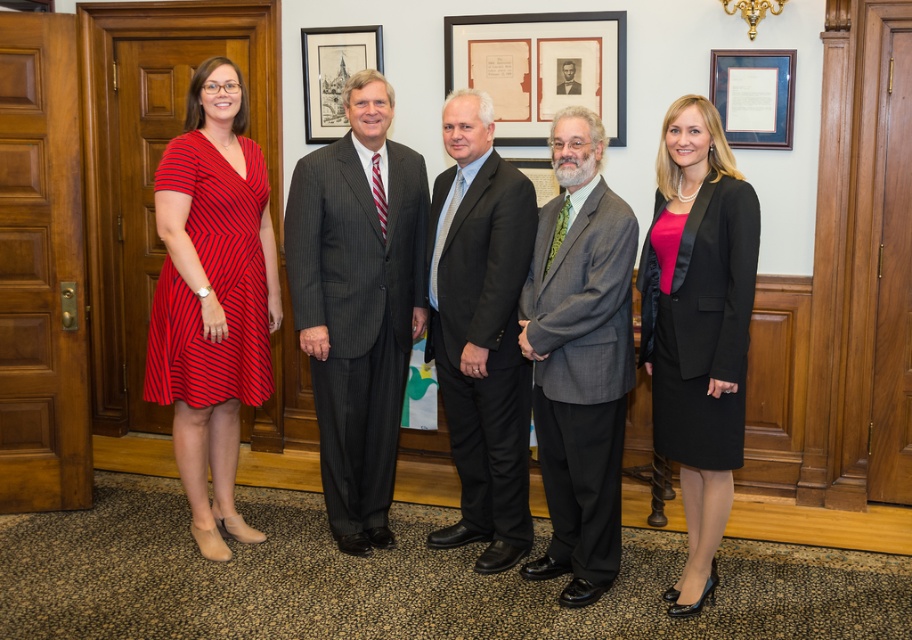
Does black satin blazer at right appear on the right side of black formal suit at center?

Correct, you'll find black satin blazer at right to the right of black formal suit at center.

Is point (738, 365) positioned after point (563, 58)?

No, it is not.

Locate an element on the screen. Image resolution: width=912 pixels, height=640 pixels. black satin blazer at right is located at coordinates (698, 324).

Looking at this image, who is positioned more to the right, black satin blazer at right or matte wooden picture frame at upper center?

From the viewer's perspective, black satin blazer at right appears more on the right side.

Locate an element on the screen. black satin blazer at right is located at coordinates (698, 324).

Is point (517, 474) farther from camera compared to point (732, 113)?

No, it is in front of (732, 113).

Is point (477, 188) in front of point (745, 68)?

That is True.

Is point (456, 250) in front of point (754, 97)?

Yes, it is.

The width and height of the screenshot is (912, 640). In order to click on dark gray suit at center in this screenshot , I will do `click(482, 332)`.